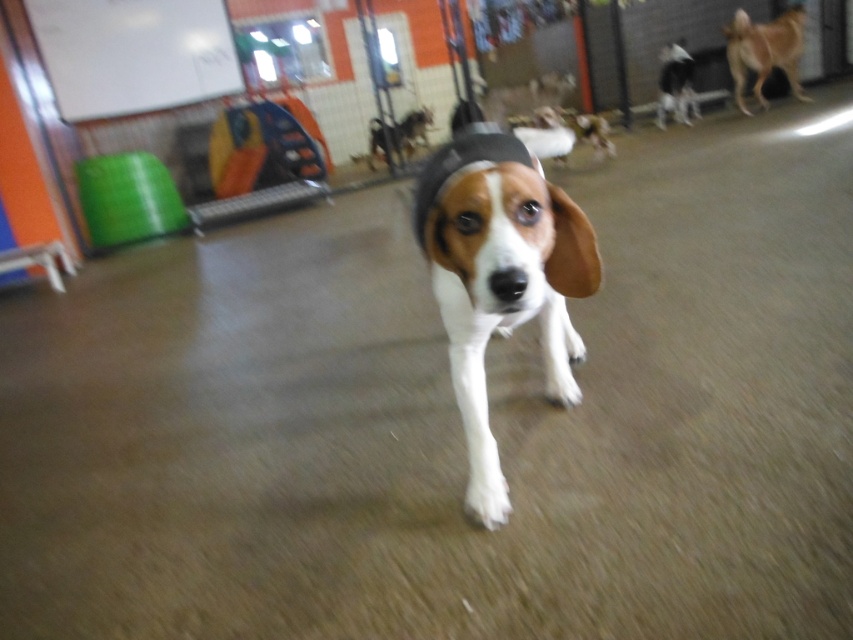
Is point (422, 177) positioned before point (683, 113)?

Yes, point (422, 177) is in front of point (683, 113).

Does point (515, 321) lie behind point (660, 84)?

No.

Is point (497, 154) farther from camera compared to point (689, 124)?

No, it is in front of (689, 124).

This screenshot has width=853, height=640. I want to click on tri-color fur dog at center, so click(500, 278).

Can you confirm if brown fur dog at upper right is positioned to the left of white fur dog at upper right?

In fact, brown fur dog at upper right is to the right of white fur dog at upper right.

This screenshot has height=640, width=853. Describe the element at coordinates (764, 51) in the screenshot. I see `brown fur dog at upper right` at that location.

Identify the location of brown fur dog at upper right. (764, 51).

Find the location of a particular element. This screenshot has width=853, height=640. brown fur dog at upper right is located at coordinates (764, 51).

Does tri-color fur dog at center have a smaller size compared to brown fur dog at upper right?

Correct, tri-color fur dog at center occupies less space than brown fur dog at upper right.

Is tri-color fur dog at center bigger than brown fur dog at upper right?

No.

Does point (480, 364) lie in front of point (788, 22)?

That is True.

In order to click on tri-color fur dog at center in this screenshot , I will do `click(500, 278)`.